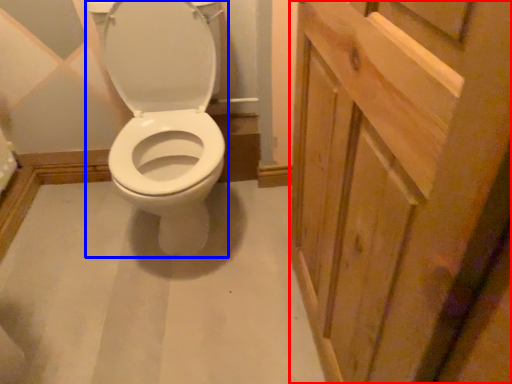
Question: Among these objects, which one is nearest to the camera, screen door (highlighted by a red box) or sit (highlighted by a blue box)?

Choices:
 (A) screen door
 (B) sit

Answer: (A)